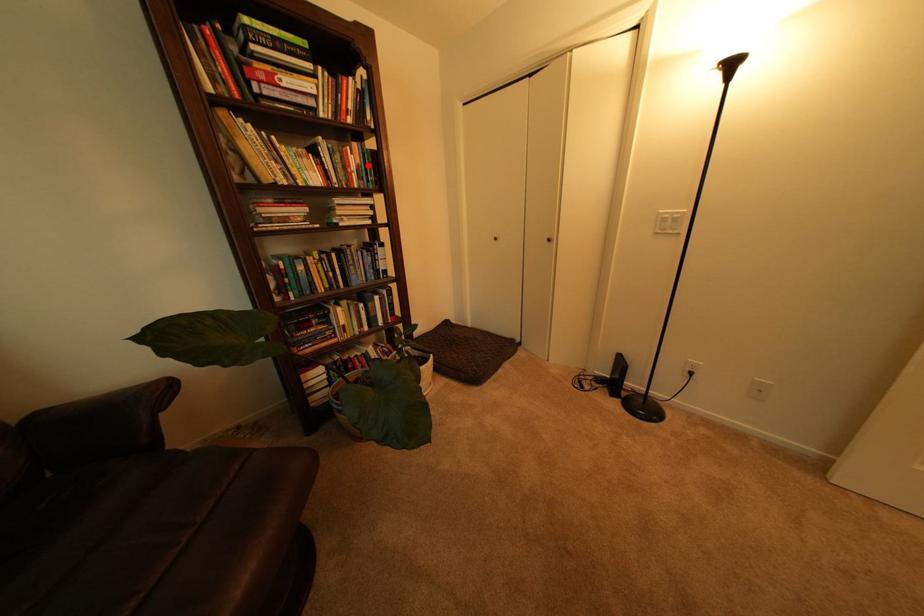
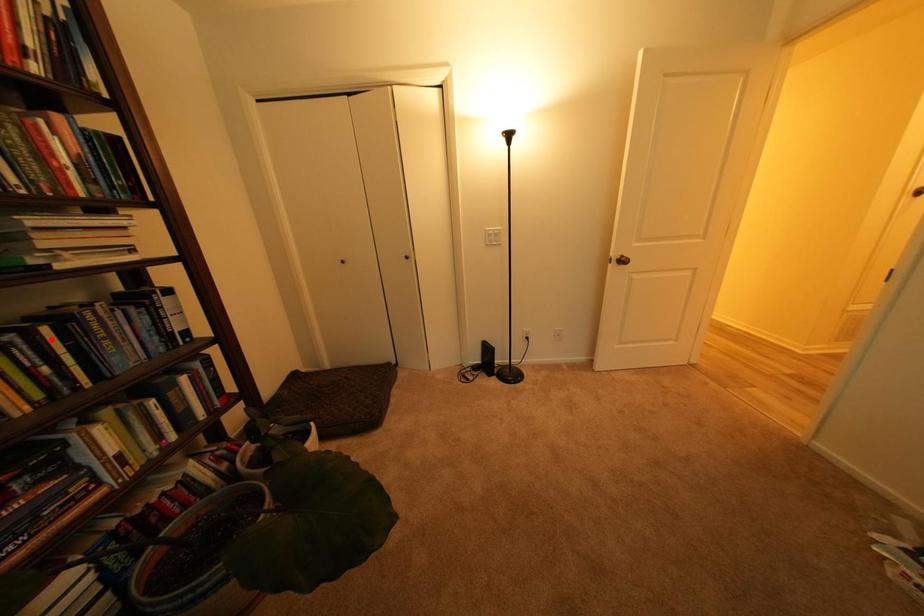
In the scene shown: I am providing you with two images of the same scene from different viewpoints. A red point is marked on the first image and another point is marked on the second image. Is the red point in image1 aligned with the point shown in image2?

No